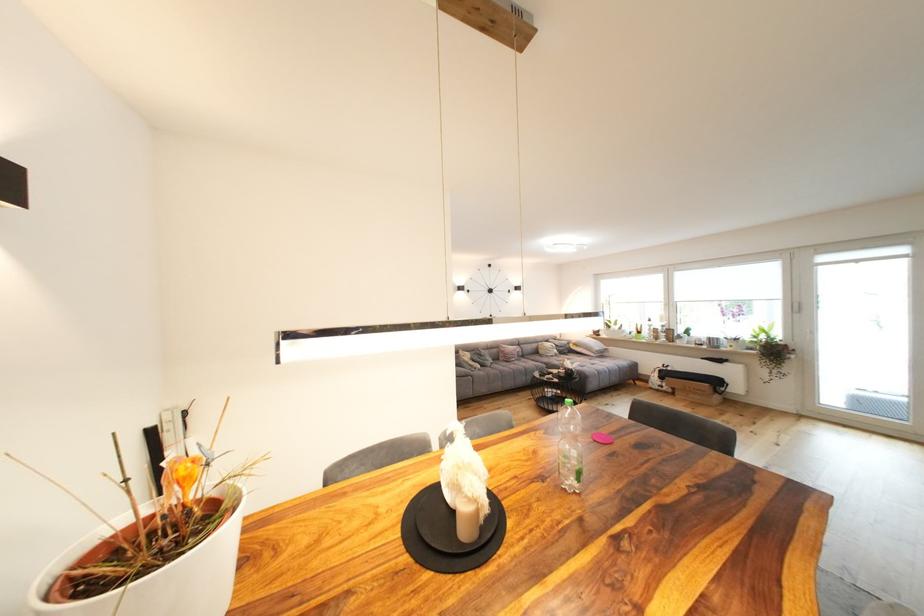
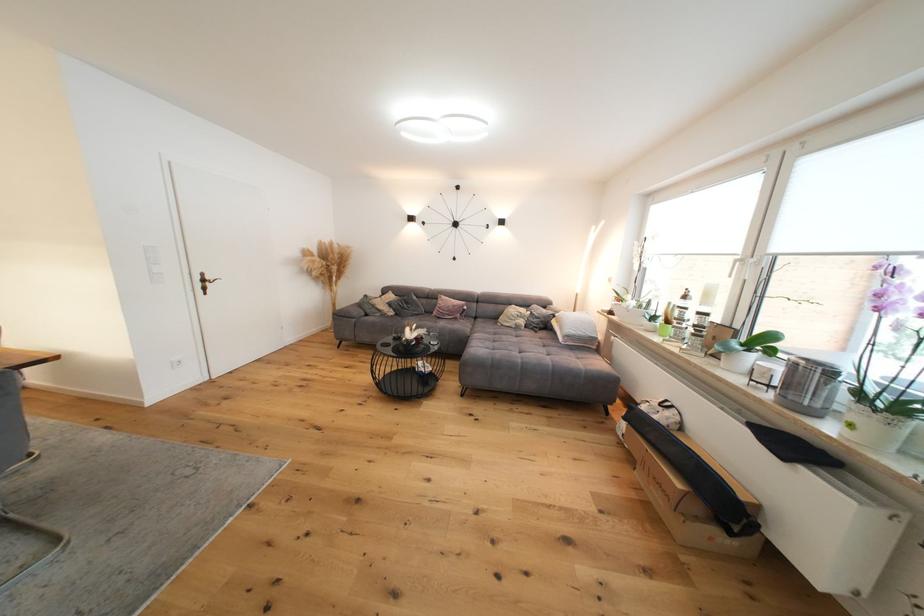
Locate, in the second image, the point that corresponds to [563,353] in the first image.

(529, 323)